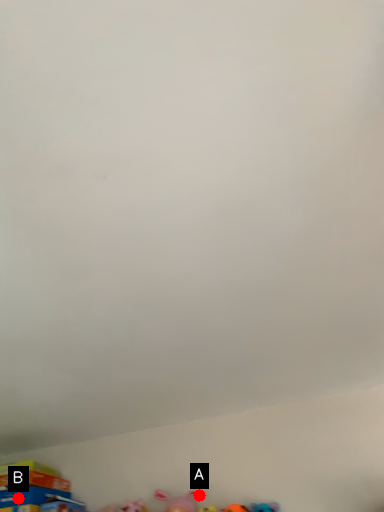
Question: Two points are circled on the image, labeled by A and B beside each circle. Which point is closer to the camera taking this photo?

Choices:
 (A) A is closer
 (B) B is closer

Answer: (A)